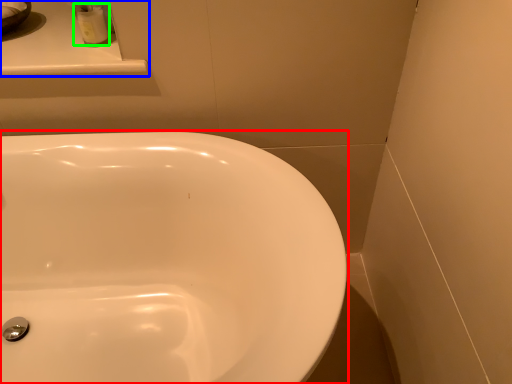
Question: Which object is the closest to the sink (highlighted by a red box)? Choose among these: counter top (highlighted by a blue box) or toiletry (highlighted by a green box).

Choices:
 (A) counter top
 (B) toiletry

Answer: (A)